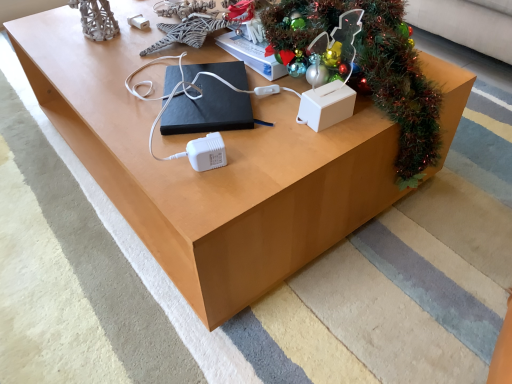
Question: Considering the positions of green shiny garland at upper right and black matte book at center in the image, is green shiny garland at upper right taller or shorter than black matte book at center?

Choices:
 (A) short
 (B) tall

Answer: (B)

Question: Would you say green shiny garland at upper right is to the left or to the right of black matte book at center in the picture?

Choices:
 (A) left
 (B) right

Answer: (B)

Question: Considering the real-world distances, which object is farthest from the white plastic tissue box at center-right?

Choices:
 (A) black matte book at center
 (B) green shiny garland at upper right

Answer: (A)

Question: Which object is the farthest from the white plastic tissue box at center-right?

Choices:
 (A) green shiny garland at upper right
 (B) black matte book at center

Answer: (B)